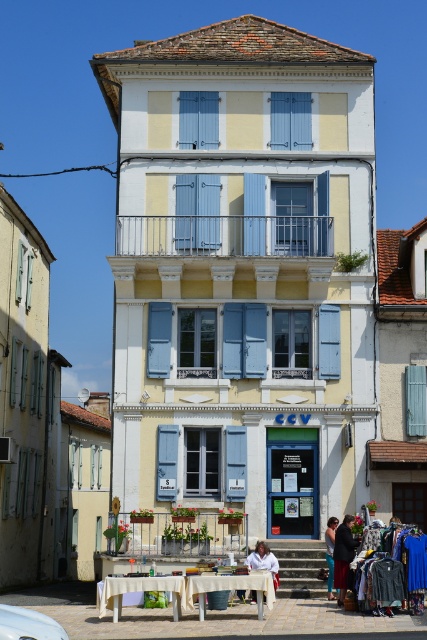
You are standing in front of the building and notice a point marked at coordinates (263,557). Based on the scene description, what object or feature is located at that point?

The point at (263,557) indicates the location of the white fabric at lower center.

You are a customer entering the building and notice two items displayed in the storefront window. The items are the dark gray fabric coat at lower right and the white fabric at lower center. Which item appears taller when viewed from the street?

The dark gray fabric coat at lower right is much taller than the white fabric at lower center, so it appears taller when viewed from the street.

You are standing in front of the building and notice two points marked on its facade. The first point is located at coordinates point (353,554), and the second is at point (251,564). Which of these two points is closer to you?

Point (353,554) is in front of point (251,564), so it is closer to you.